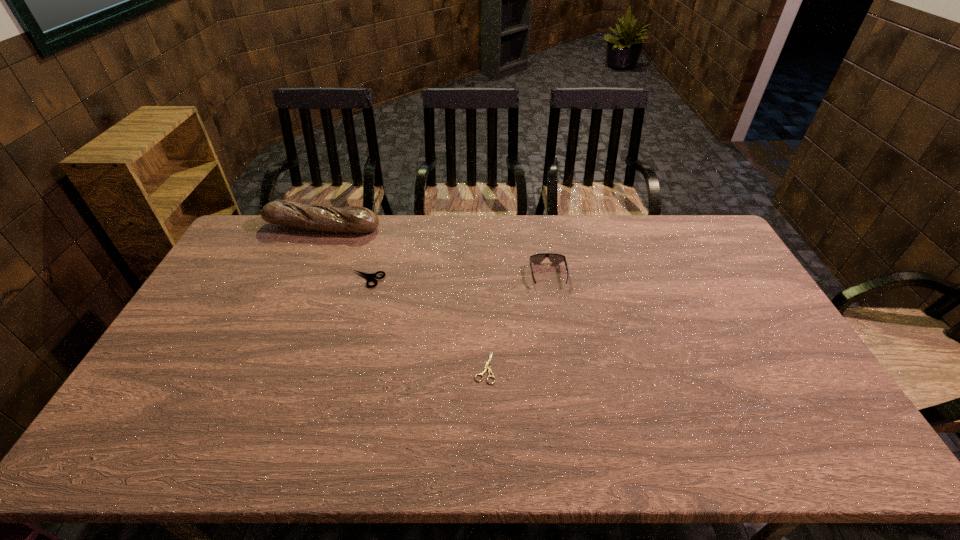
The width and height of the screenshot is (960, 540). I want to click on vacant space located on the left of the taller shears, so click(249, 279).

Image resolution: width=960 pixels, height=540 pixels. What are the coordinates of `vacant region located 0.170m on the back of the nearer shears` in the screenshot? It's located at (484, 308).

Image resolution: width=960 pixels, height=540 pixels. I want to click on object present at the far edge, so click(353, 219).

This screenshot has width=960, height=540. I want to click on object situated at the left edge, so (x=353, y=219).

Find the location of a particular element. The image size is (960, 540). object that is at the far left corner is located at coordinates (353, 219).

What are the coordinates of `blank area at the far edge` in the screenshot? It's located at (534, 221).

The image size is (960, 540). In order to click on vacant space at the near edge in this screenshot , I will do `click(757, 430)`.

Identify the location of vacant region at the right edge of the desktop. This screenshot has width=960, height=540. (722, 321).

This screenshot has width=960, height=540. Find the location of `free space at the near right corner`. free space at the near right corner is located at coordinates (854, 446).

At what (x,y) coordinates should I click in order to perform the action: click on vacant space that's between the rightmost object and the second shortest object. Please return your answer as a coordinate pair (x, y). This screenshot has width=960, height=540. Looking at the image, I should click on [458, 277].